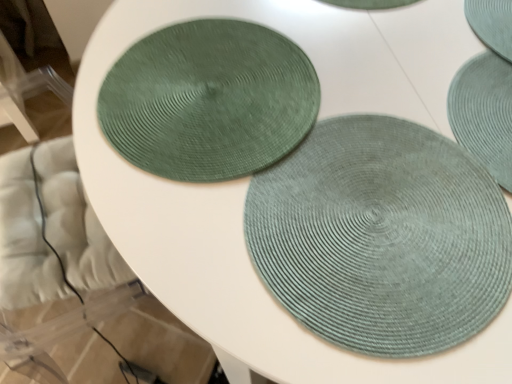
Where is `free space above green woven coaster at upper left, the 1th coaster when ordered from left to right (from a real-world perspective)`? Image resolution: width=512 pixels, height=384 pixels. free space above green woven coaster at upper left, the 1th coaster when ordered from left to right (from a real-world perspective) is located at coordinates (210, 93).